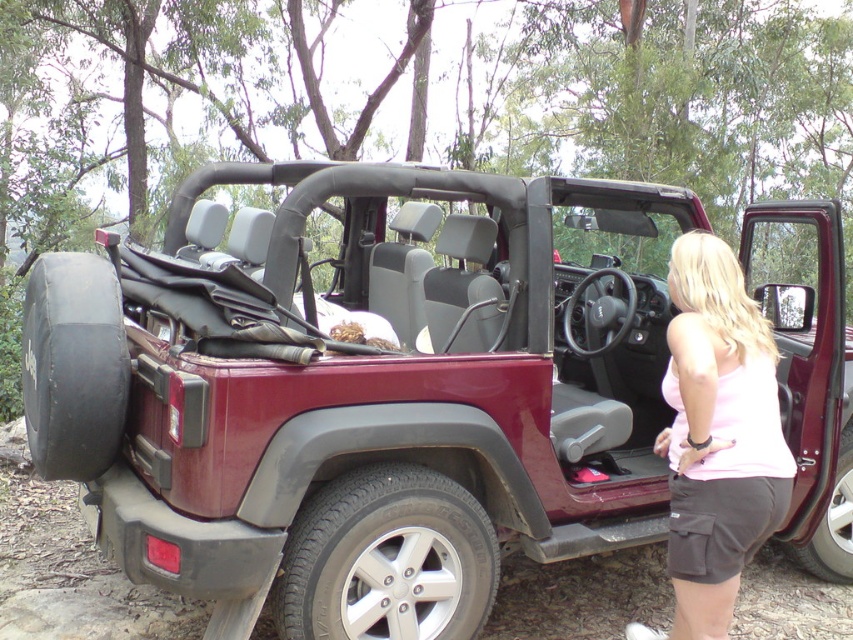
Question: Among these objects, which one is nearest to the camera?

Choices:
 (A) pink cotton tank top at center
 (B) maroon matte jeep at center

Answer: (A)

Question: Does maroon matte jeep at center have a larger size compared to pink cotton tank top at center?

Choices:
 (A) no
 (B) yes

Answer: (B)

Question: Observing the image, what is the correct spatial positioning of maroon matte jeep at center in reference to pink cotton tank top at center?

Choices:
 (A) above
 (B) below

Answer: (A)

Question: Can you confirm if maroon matte jeep at center is positioned below pink cotton tank top at center?

Choices:
 (A) yes
 (B) no

Answer: (B)